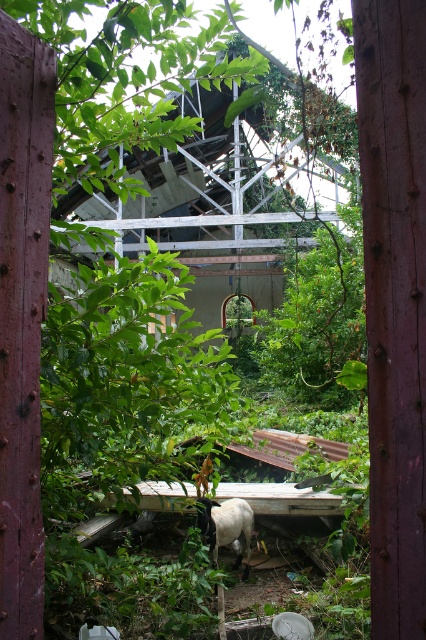
Question: Considering the relative positions of concrete structure at center and white woolly sheep at center in the image provided, where is concrete structure at center located with respect to white woolly sheep at center?

Choices:
 (A) right
 (B) left

Answer: (B)

Question: Among these points, which one is farthest from the camera?

Choices:
 (A) (212, 552)
 (B) (66, 200)

Answer: (B)

Question: In this image, where is concrete structure at center located relative to white woolly sheep at center?

Choices:
 (A) below
 (B) above

Answer: (B)

Question: Is concrete structure at center in front of white woolly sheep at center?

Choices:
 (A) no
 (B) yes

Answer: (A)

Question: Which point is farther to the camera?

Choices:
 (A) white woolly sheep at center
 (B) concrete structure at center

Answer: (B)